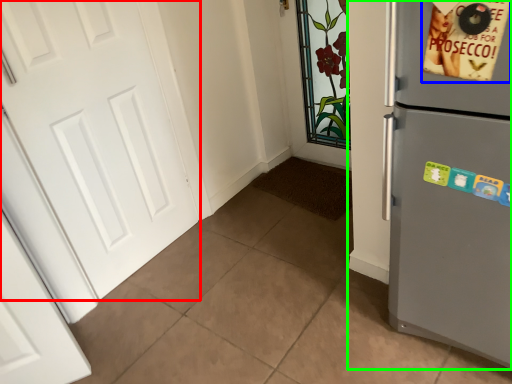
Question: Estimate the real-world distances between objects in this image. Which object is closer to door (highlighted by a red box), postcard (highlighted by a blue box) or refrigerator (highlighted by a green box)?

Choices:
 (A) postcard
 (B) refrigerator

Answer: (B)